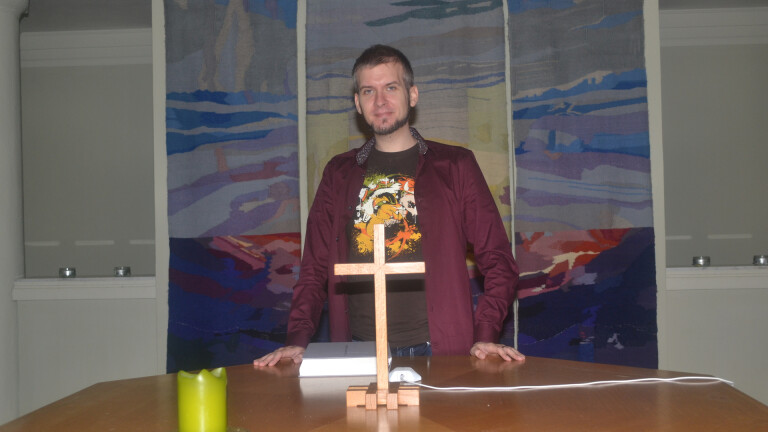
This screenshot has width=768, height=432. I want to click on wodden table, so click(487, 400).